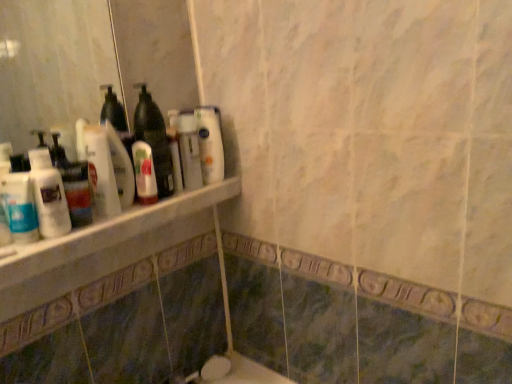
Question: Considering the positions of point (3, 39) and point (183, 203), is point (3, 39) closer or farther from the camera than point (183, 203)?

Choices:
 (A) closer
 (B) farther

Answer: (B)

Question: From the image's perspective, is white glossy bottles at upper left positioned above or below white marble ledge at upper left?

Choices:
 (A) below
 (B) above

Answer: (B)

Question: Which is nearer to the white marble ledge at upper left?

Choices:
 (A) white glossy mouthwash at left, positioned as the 2th mouthwash in right-to-left order
 (B) translucent plastic mouthwash at shelf center, which appears as the second mouthwash when viewed from the left
 (C) white glossy bottle at upper center, which is counted as the 1th cleaning product, starting from the right
 (D) translucent plastic bottle at center
 (E) white glossy bottles at upper left

Answer: (B)

Question: Which of these objects is positioned farthest from the white glossy bottle at upper center, which is counted as the 1th cleaning product, starting from the right?

Choices:
 (A) translucent plastic bottle at upper left, the second cleaning product in the back-to-front sequence
 (B) white glossy mouthwash at left, which is the second mouthwash in back-to-front order
 (C) white glossy bottles at upper left
 (D) white marble ledge at upper left
 (E) translucent plastic bottle at center

Answer: (C)